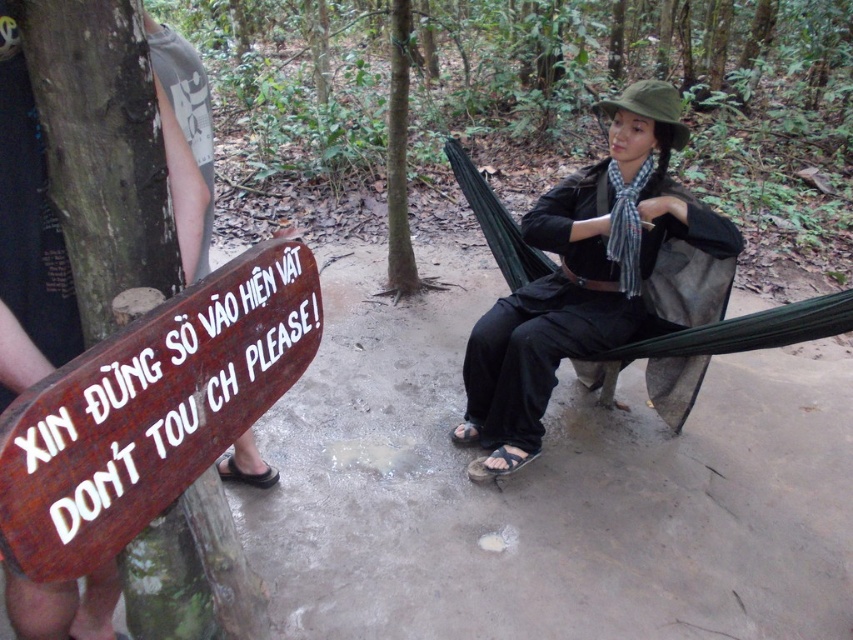
You are a hiker who has just arrived at this muddy forest area. You see a green rough bark tree at center and a brown leather sandal at lower left. Which object is closer to you?

The green rough bark tree at center is positioned over the brown leather sandal at lower left, meaning it is closer to you.